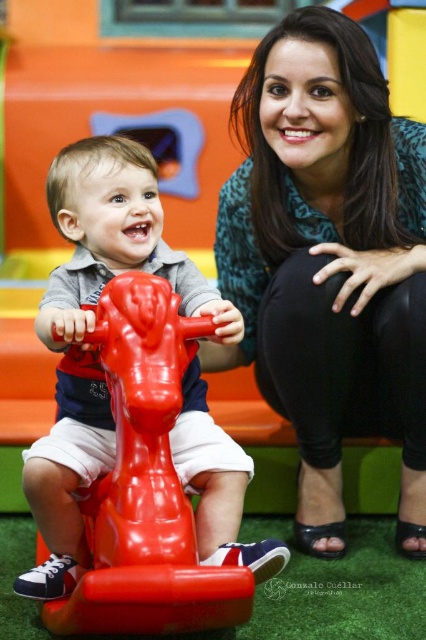
Question: Is matte green blouse at center below rubber toy horse at center?

Choices:
 (A) yes
 (B) no

Answer: (B)

Question: Does matte green blouse at center appear on the right side of rubber toy horse at center?

Choices:
 (A) yes
 (B) no

Answer: (A)

Question: Which object appears closest to the camera in this image?

Choices:
 (A) rubber toy horse at center
 (B) matte green blouse at center

Answer: (A)

Question: Is matte green blouse at center smaller than rubber toy horse at center?

Choices:
 (A) no
 (B) yes

Answer: (A)

Question: Which of the following is the farthest from the observer?

Choices:
 (A) matte green blouse at center
 (B) rubber toy horse at center

Answer: (A)

Question: Which point appears farthest from the camera in this image?

Choices:
 (A) (308, 237)
 (B) (224, 454)

Answer: (A)